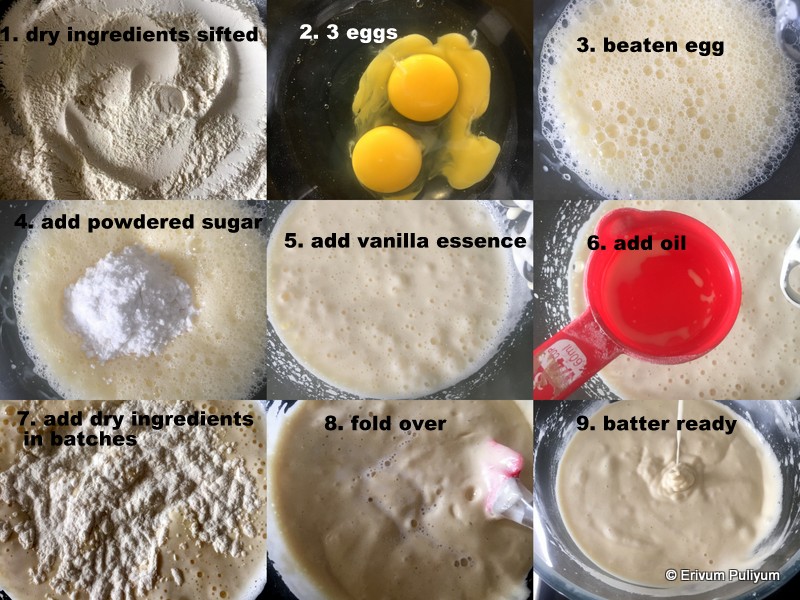
At what (x,y) coordinates should I click in order to perform the action: click on black bowl. Please return your answer as a coordinate pair (x, y). Looking at the image, I should click on (294, 140).